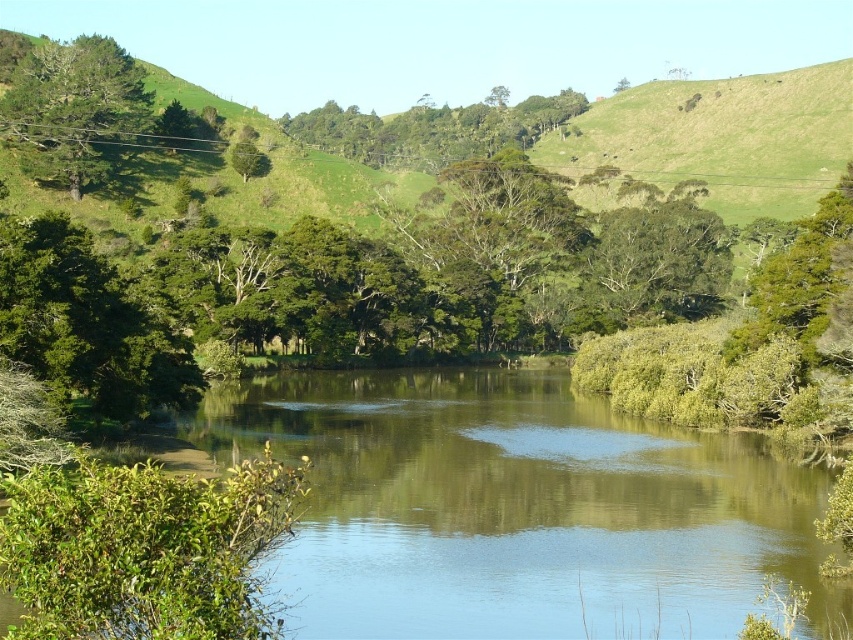
You are standing at the edge of the river and see two points in the image. The first point is at coordinates point (328,376) and the second is at point (323,136). Which point is nearer to you?

Point (328,376) is closer to the viewer than point (323,136), so the first point is nearer to you.

You are a photographer planning to capture the entire scene in one shot. Given that your camera can only focus on objects within a 100cm width, and the green smooth water at center takes up 80cm of the frame, will the green leafy tree at left fit entirely within the remaining space?

The green smooth water at center is larger in size than the green leafy tree at left. Since the water takes up 80cm of the 100cm frame width, there is 20cm remaining. The tree, being smaller than the water, would fit within the remaining space.